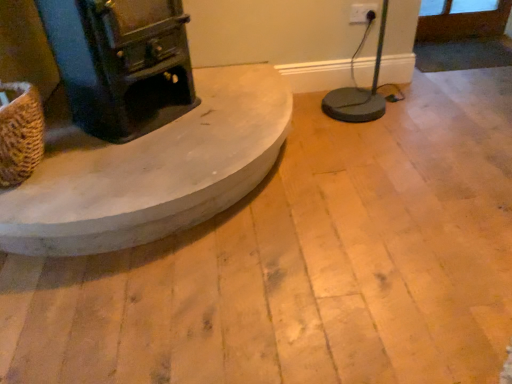
Question: Considering their positions, is brown woven basket at left located in front of or behind white plastic electric outlet at upper right?

Choices:
 (A) front
 (B) behind

Answer: (A)

Question: Would you say brown woven basket at left is inside or outside white plastic electric outlet at upper right?

Choices:
 (A) inside
 (B) outside

Answer: (B)

Question: Which is farther from the white plastic electric outlet at upper right?

Choices:
 (A) smooth concrete hearth at center
 (B) brown woven basket at left

Answer: (B)

Question: Which is nearer to the white plastic electric outlet at upper right?

Choices:
 (A) brown woven basket at left
 (B) smooth concrete hearth at center

Answer: (B)